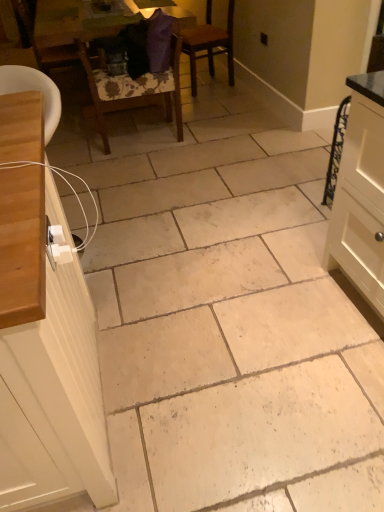
Find the location of `vacant space to the left of wooden chair at center, the 2th chair in the left-to-right sequence`. vacant space to the left of wooden chair at center, the 2th chair in the left-to-right sequence is located at coordinates (78, 141).